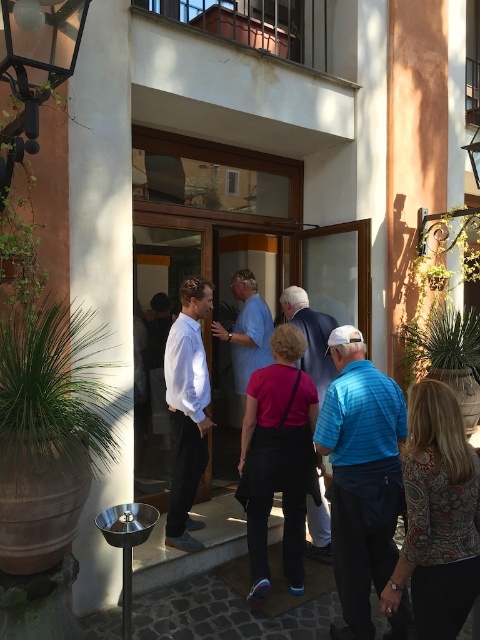
Who is more forward, (351, 561) or (190, 470)?

Point (351, 561) is in front.

Is blue striped polo shirt at center to the right of white smooth shirt at center from the viewer's perspective?

Yes, blue striped polo shirt at center is to the right of white smooth shirt at center.

Locate an element on the screen. This screenshot has height=640, width=480. blue striped polo shirt at center is located at coordinates (360, 476).

Who is taller, printed fabric jacket at lower right or matte pink shirt at center?

matte pink shirt at center is taller.

Does printed fabric jacket at lower right have a larger size compared to matte pink shirt at center?

Incorrect, printed fabric jacket at lower right is not larger than matte pink shirt at center.

Is point (403, 568) positioned behind point (254, 372)?

No, it is in front of (254, 372).

Locate an element on the screen. This screenshot has height=640, width=480. printed fabric jacket at lower right is located at coordinates (437, 515).

Which is in front, point (91, 289) or point (467, 488)?

Point (467, 488) is more forward.

Does silver metallic pole at left have a greater width compared to printed fabric jacket at lower right?

No, silver metallic pole at left is not wider than printed fabric jacket at lower right.

Does point (100, 248) lie behind point (445, 452)?

Yes, it is.

Locate an element on the screen. Image resolution: width=480 pixels, height=640 pixels. silver metallic pole at left is located at coordinates (103, 180).